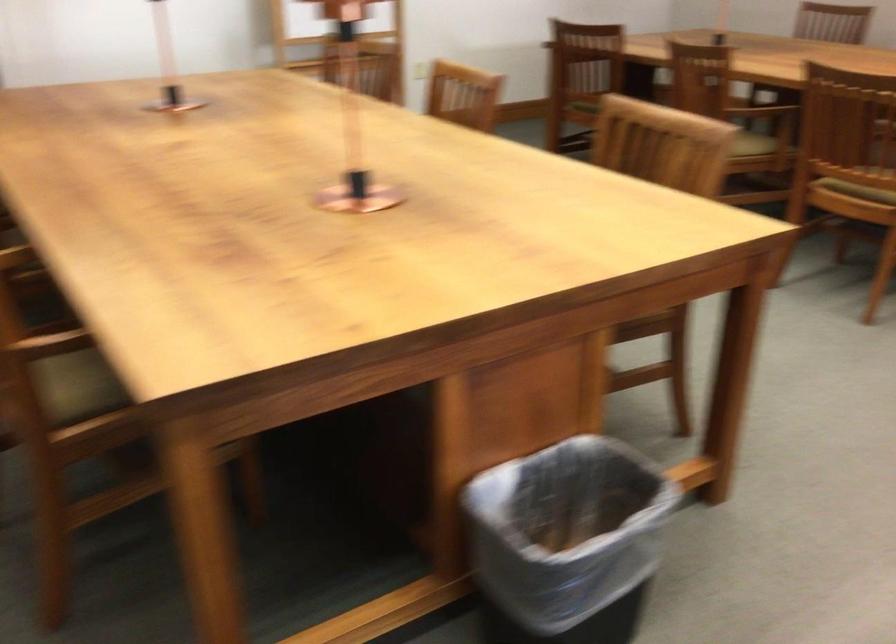
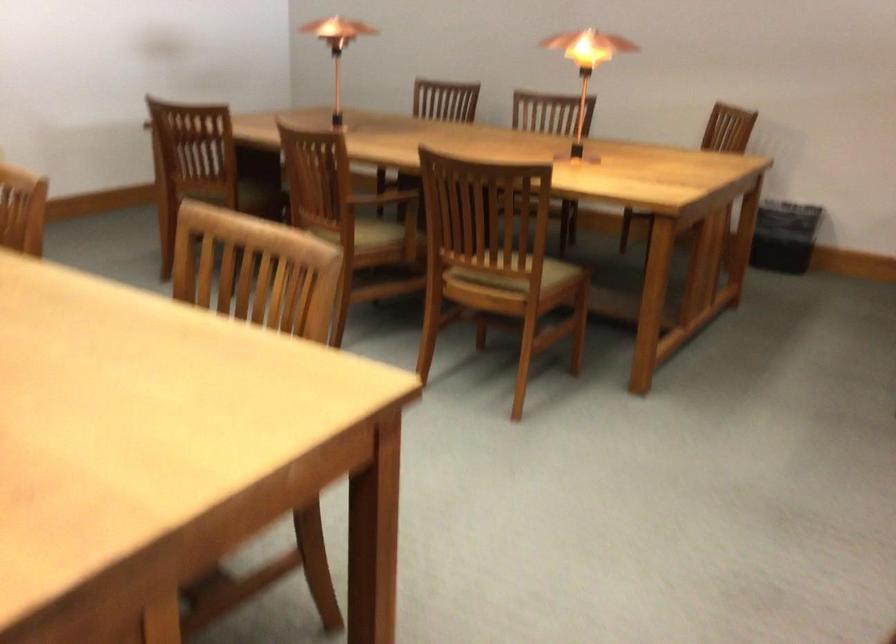
In a continuous first-person perspective shot, in which direction is the camera moving?

The cameraman walked toward right, forward.